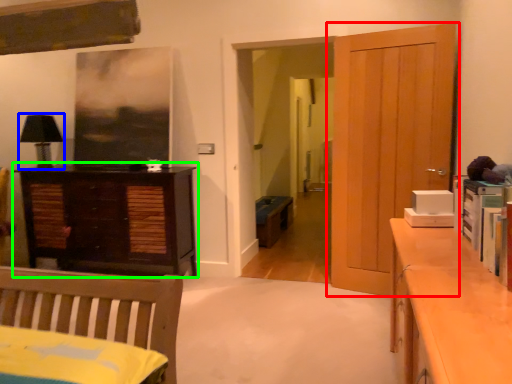
Question: Estimate the real-world distances between objects in this image. Which object is closer to door (highlighted by a red box), lamp (highlighted by a blue box) or chest of drawers (highlighted by a green box)?

Choices:
 (A) lamp
 (B) chest of drawers

Answer: (B)